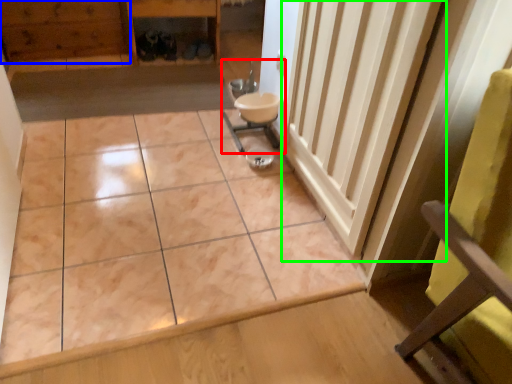
Question: Which object is the farthest from sink (highlighted by a red box)? Choose among these: hardwood (highlighted by a blue box) or radiator (highlighted by a green box).

Choices:
 (A) hardwood
 (B) radiator

Answer: (A)